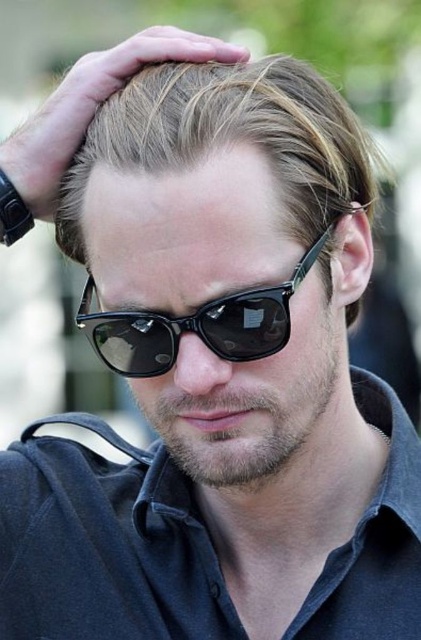
Question: Among these objects, which one is farthest from the camera?

Choices:
 (A) dark blue cotton polo shirt at center
 (B) black plastic sunglasses at center

Answer: (A)

Question: Can you confirm if dark blue cotton polo shirt at center is positioned to the right of black plastic sunglasses at center?

Choices:
 (A) no
 (B) yes

Answer: (B)

Question: Which point is farther to the camera?

Choices:
 (A) black plastic sunglasses at center
 (B) dark blue cotton polo shirt at center
 (C) light brown smooth hair at center

Answer: (B)

Question: Can you confirm if dark blue cotton polo shirt at center is smaller than light brown smooth hair at center?

Choices:
 (A) yes
 (B) no

Answer: (B)

Question: Which object appears closest to the camera in this image?

Choices:
 (A) dark blue cotton polo shirt at center
 (B) light brown smooth hair at center

Answer: (B)

Question: Is light brown smooth hair at center smaller than black plastic sunglasses at center?

Choices:
 (A) yes
 (B) no

Answer: (B)